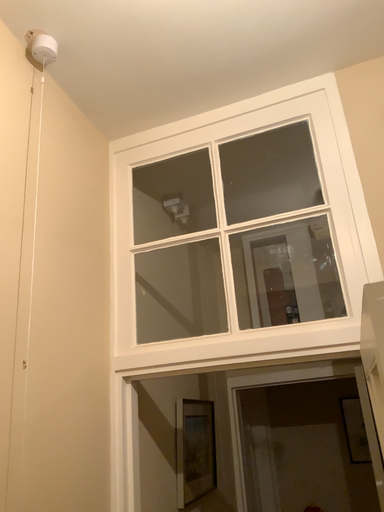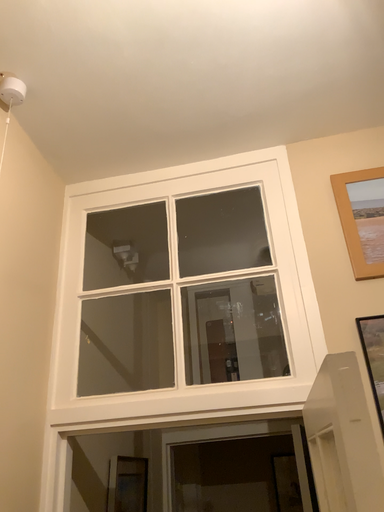
Question: Which way did the camera rotate in the video?

Choices:
 (A) rotated left
 (B) rotated right

Answer: (B)